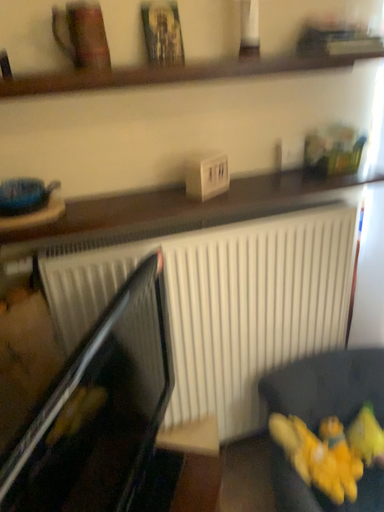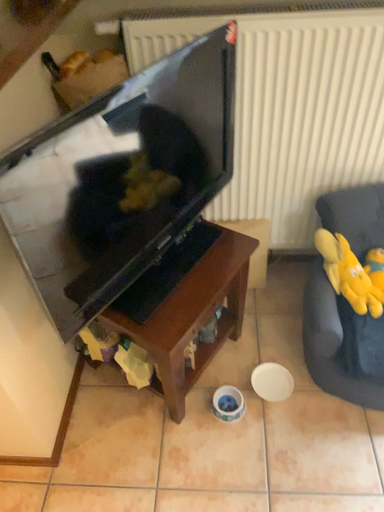
Question: Which way did the camera rotate in the video?

Choices:
 (A) rotated right
 (B) rotated left

Answer: (B)